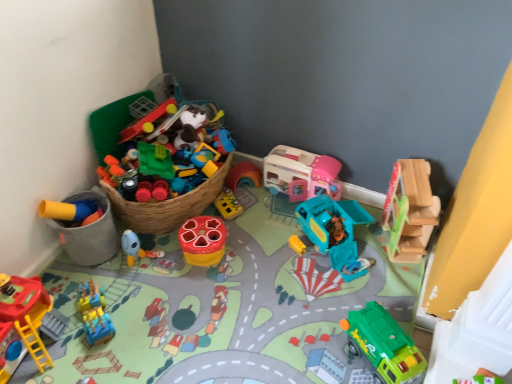
Where is `vacant space positioned to the left of pink plastic playhouse at upper right, acting as the fourth toy starting from the right`? The height and width of the screenshot is (384, 512). vacant space positioned to the left of pink plastic playhouse at upper right, acting as the fourth toy starting from the right is located at coordinates (252, 200).